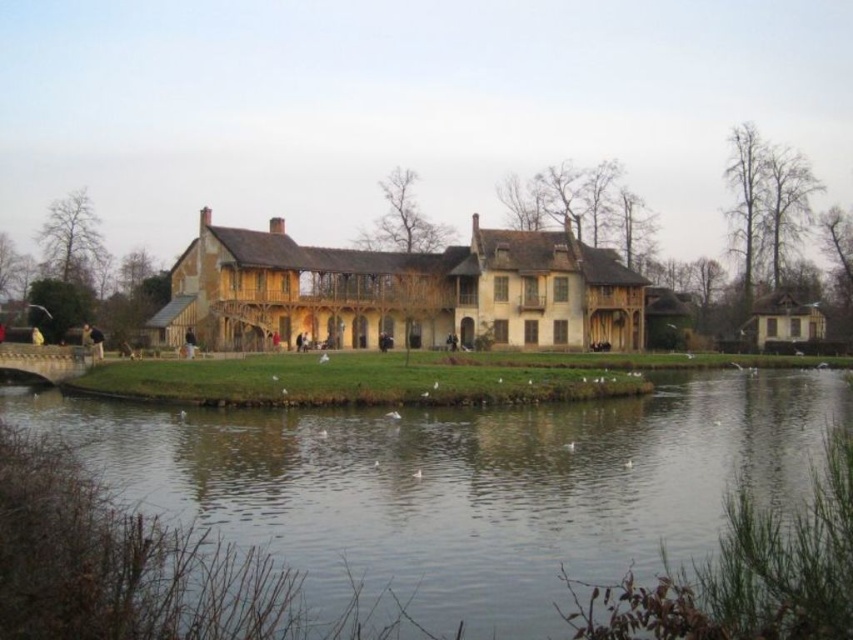
You are a visitor standing at the edge of the green water at lower center and want to enter the wooden mansion at center. Which direction should you move to reach it?

Since the green water at lower center is positioned under the wooden mansion at center, you should move upward to reach the wooden mansion at center from the green water at lower center.